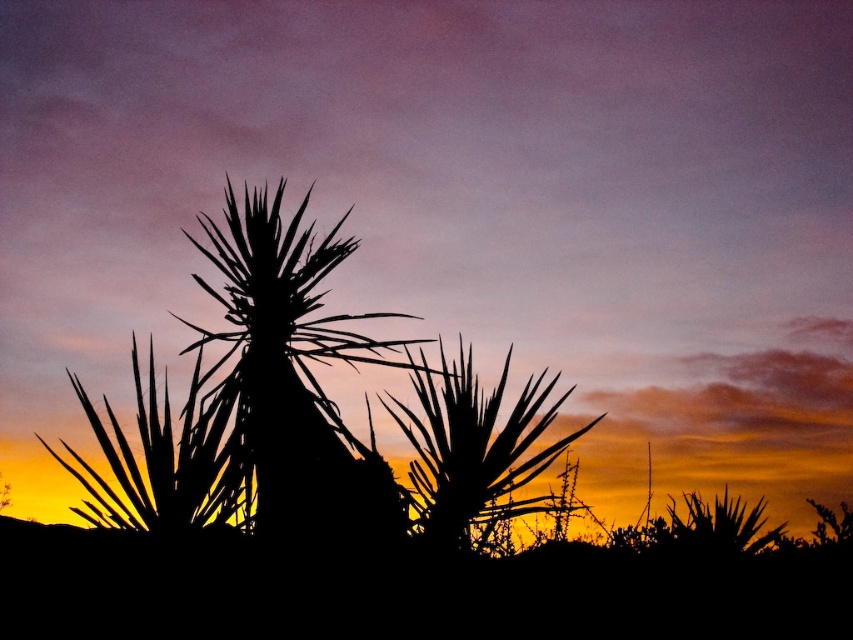
Does point (393, 525) come farther from viewer compared to point (436, 538)?

That is False.

Measure the distance between black spiky plant at center and camera.

black spiky plant at center and camera are 1.47 meters apart from each other.

The width and height of the screenshot is (853, 640). What do you see at coordinates (294, 380) in the screenshot?
I see `black spiky plant at center` at bounding box center [294, 380].

Identify the location of black spiky plant at center. This screenshot has width=853, height=640. (294, 380).